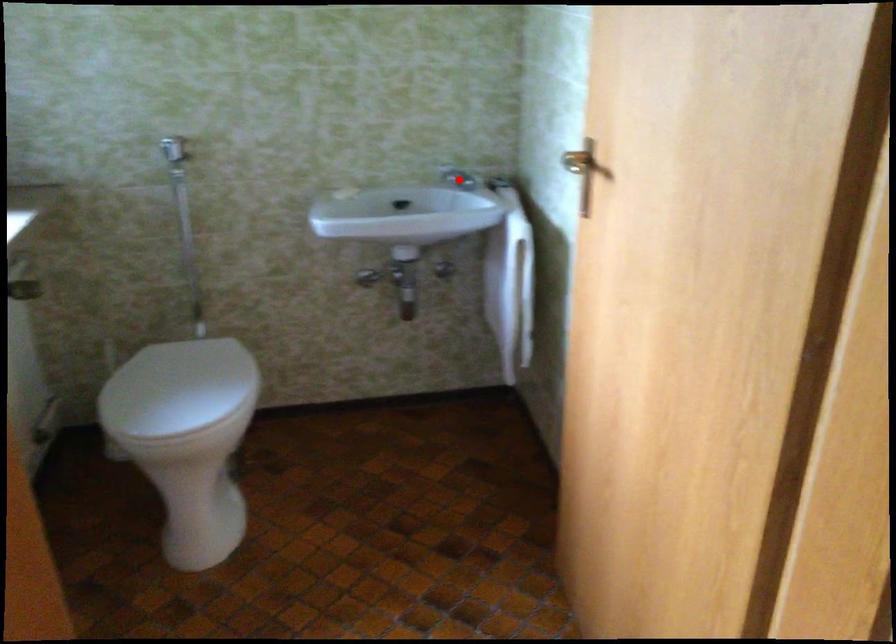
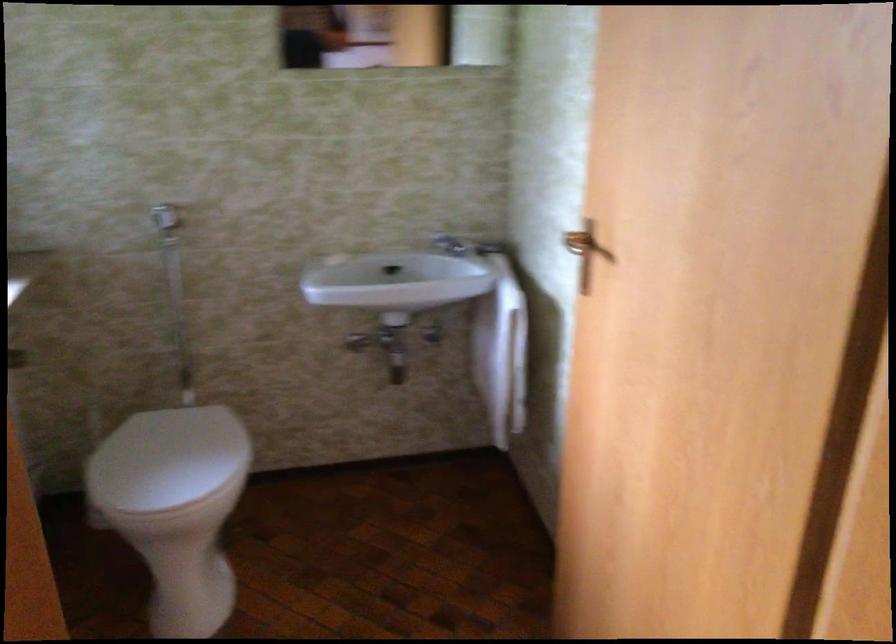
Where in the second image is the point corresponding to the highlighted location from the first image?

(450, 245)